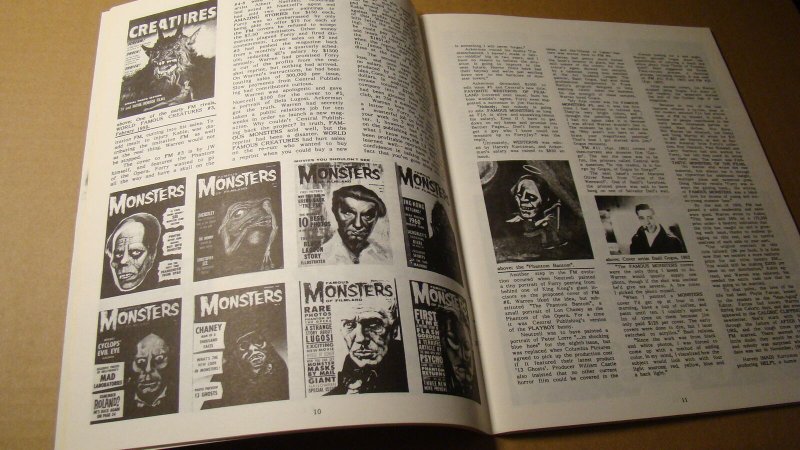
The height and width of the screenshot is (450, 800). Identify the location of magazine page. (561, 28), (222, 48).